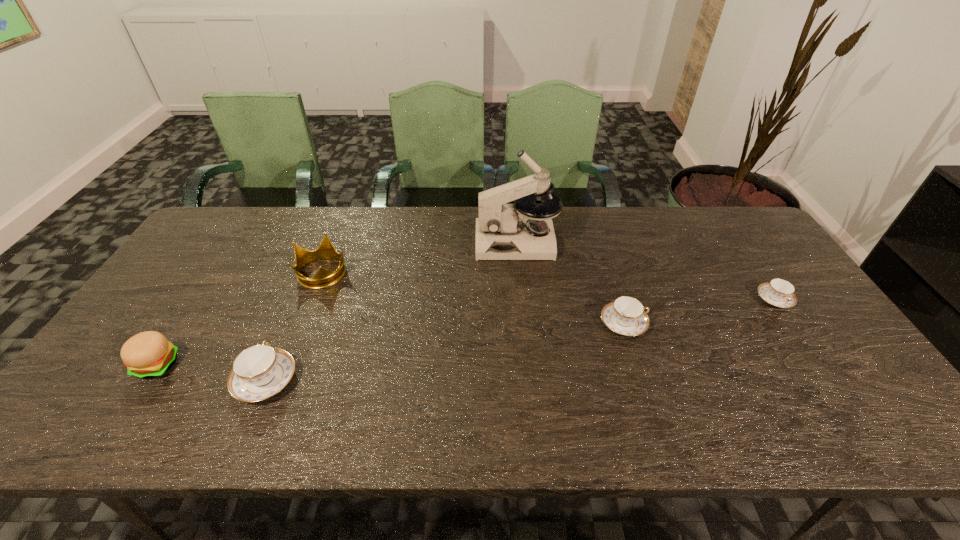
The height and width of the screenshot is (540, 960). In order to click on free space between the crown and the tallest teacup in this screenshot , I will do `click(295, 326)`.

Identify which object is located as the second nearest to the crown. Please provide its 2D coordinates. Your answer should be formatted as a tuple, i.e. [(x, y)], where the tuple contains the x and y coordinates of a point satisfying the conditions above.

[(149, 354)]

Identify which object is located as the fourth nearest to the second teacup from right to left. Please provide its 2D coordinates. Your answer should be formatted as a tuple, i.e. [(x, y)], where the tuple contains the x and y coordinates of a point satisfying the conditions above.

[(260, 371)]

Locate an element on the screen. The width and height of the screenshot is (960, 540). teacup that stands as the closest to the second shortest teacup is located at coordinates (778, 292).

Identify which teacup is the second closest to the hamburger. Please provide its 2D coordinates. Your answer should be formatted as a tuple, i.e. [(x, y)], where the tuple contains the x and y coordinates of a point satisfying the conditions above.

[(626, 316)]

You are a GUI agent. You are given a task and a screenshot of the screen. Output one action in this format:
    pyautogui.click(x=<x>, y=<y>)
    Task: Click on the free point that satisfies the following two spatial constraints: 1. at the eyepiece of the fourth object from left to right; 2. on the front side of the crown
    The image size is (960, 540).
    Given the screenshot: What is the action you would take?
    pyautogui.click(x=519, y=272)

At what (x,y) coordinates should I click in order to perform the action: click on free space that satisfies the following two spatial constraints: 1. on the side with the handle of the crown; 2. on the right side of the nearest teacup. Please return your answer as a coordinate pair (x, y). The image size is (960, 540). Looking at the image, I should click on (310, 272).